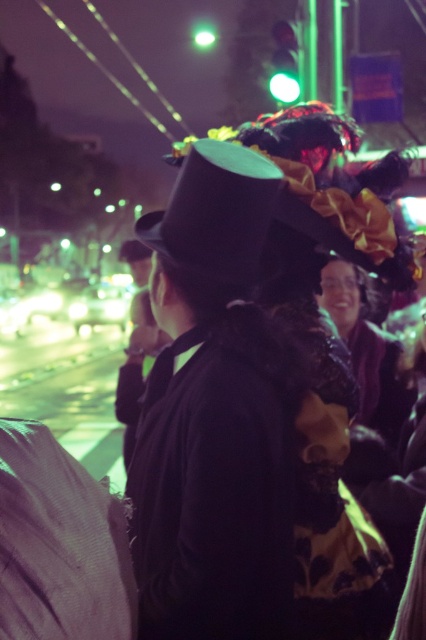
Question: Which of the following is the farthest from the observer?

Choices:
 (A) matte black hat at center
 (B) sparkly purple dress at center

Answer: (B)

Question: Which point is closer to the camera?

Choices:
 (A) (137, 346)
 (B) (270, 346)

Answer: (B)

Question: Is sparkly purple dress at center positioned at the back of matte black jacket at center?

Choices:
 (A) yes
 (B) no

Answer: (B)

Question: Which point appears closest to the camera in this image?

Choices:
 (A) (367, 330)
 (B) (203, 280)
 (C) (135, 323)

Answer: (B)

Question: Is matte black hat at center above matte black jacket at center?

Choices:
 (A) yes
 (B) no

Answer: (B)

Question: Is matte black hat at center bigger than matte black jacket at center?

Choices:
 (A) yes
 (B) no

Answer: (A)